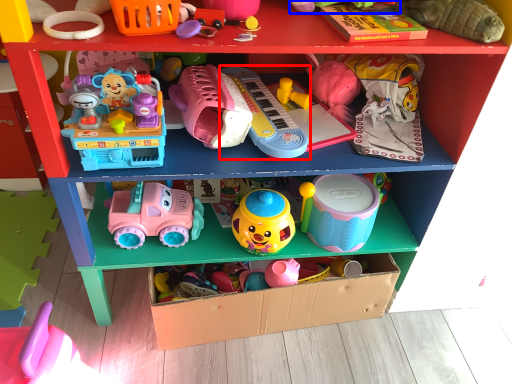
Question: Which object appears closest to the camera in this image, toy (highlighted by a red box) or toy (highlighted by a blue box)?

Choices:
 (A) toy
 (B) toy

Answer: (B)